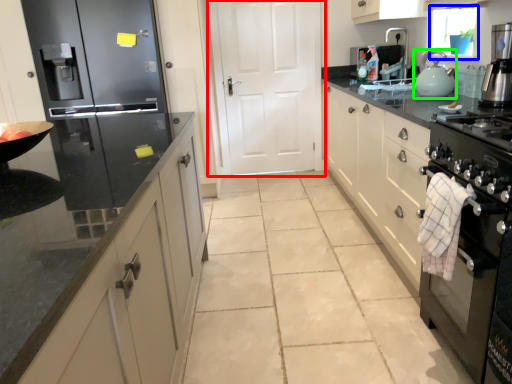
Question: Which object is positioned farthest from door (highlighted by a red box)? Select from window screen (highlighted by a blue box) and kitchen appliance (highlighted by a green box).

Choices:
 (A) window screen
 (B) kitchen appliance

Answer: (B)